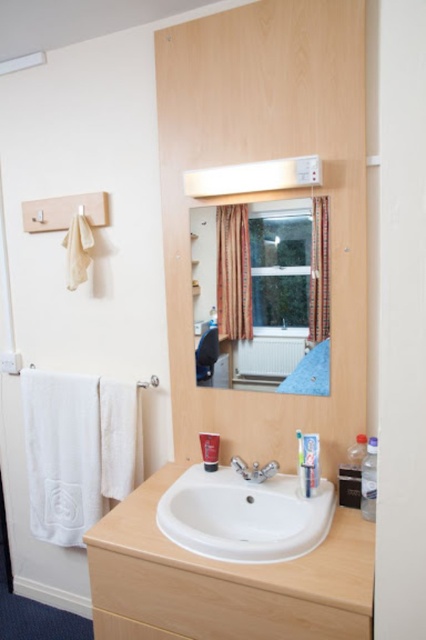
You are designing a bathroom layout and need to place a decorative item between the brown textured curtain at center and the silver metallic towel bar at upper left. Which object has a greater width to accommodate the item?

The brown textured curtain at center has a greater width than the silver metallic towel bar at upper left, so the decorative item should be placed next to the brown textured curtain at center.

You are a delivery person trying to place a 1.5 meter long package between the plaid fabric curtain at upper center and the bathroom door. Is there enough space?

The distance between the plaid fabric curtain at upper center and the bathroom door is 1.45 meters, which is shorter than the package length of 1.5 meters. Therefore, the package cannot fit in that space.